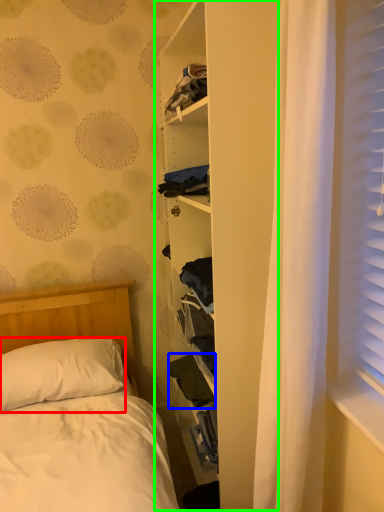
Question: Which object is the farthest from pillow (highlighted by a red box)? Choose among these: clothing (highlighted by a blue box) or bookshelf (highlighted by a green box).

Choices:
 (A) clothing
 (B) bookshelf

Answer: (B)